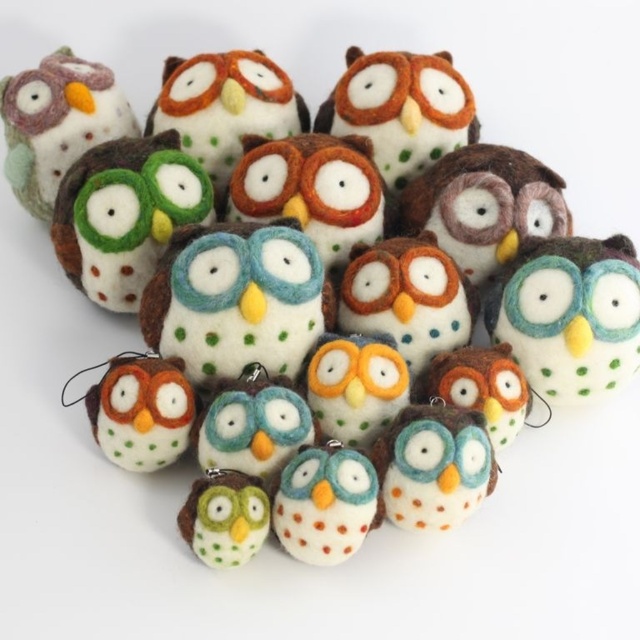
Can you confirm if matte felt owl at center is positioned above matte felt owl at upper left?

Incorrect, matte felt owl at center is not positioned above matte felt owl at upper left.

Does matte felt owl at center appear under matte felt owl at upper left?

Yes, matte felt owl at center is below matte felt owl at upper left.

Does point (600, 326) lie behind point (65, 88)?

No.

Where is `matte felt owl at center`? matte felt owl at center is located at coordinates (570, 314).